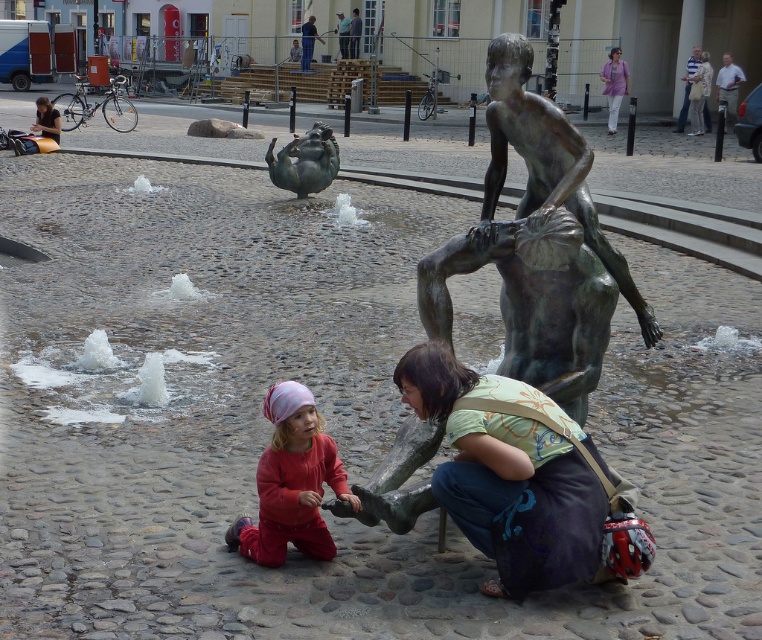
You are an art student trying to sketch the scene. You notice the bronze statue at lower center and the light purple fabric shirt at upper right. Which object should you focus on first if you want to draw the smaller one first?

The bronze statue at lower center should be focused on first because it has a smaller size compared to the light purple fabric shirt at upper right.

You are a photographer standing in the plaza. You want to capture both the bronze statue at lower center and the light purple fabric shirt at upper right in a single frame. Based on their sizes, which object should you focus on to ensure both fit in the photo?

The bronze statue at lower center is shorter than the light purple fabric shirt at upper right. To ensure both fit in the photo, focus on the bronze statue at lower center since it is smaller and can be framed alongside the taller light purple fabric shirt at upper right.